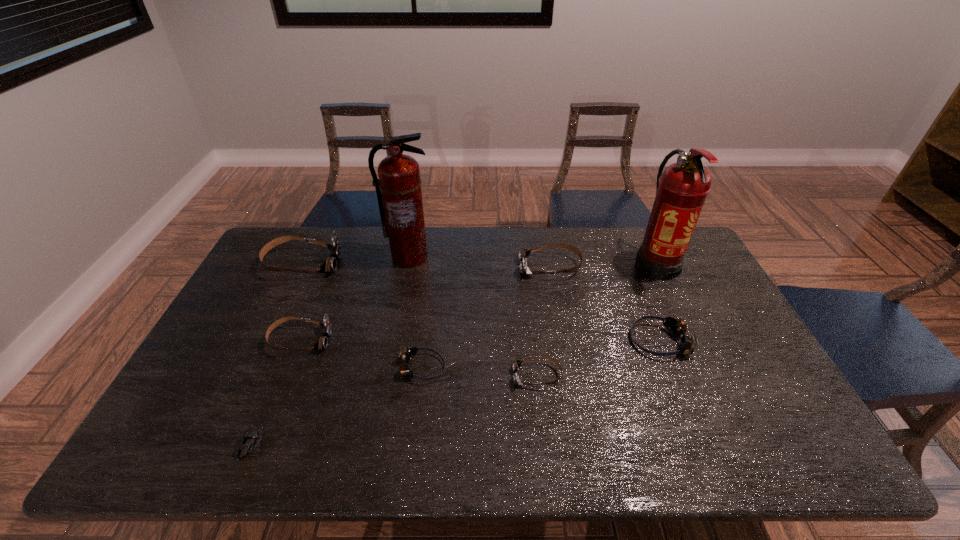
At what (x,y) coordinates should I click in order to perform the action: click on the smallest brown goggles. Please return your answer as a coordinate pair (x, y). The width and height of the screenshot is (960, 540). Looking at the image, I should click on (516, 364).

You are a GUI agent. You are given a task and a screenshot of the screen. Output one action in this format:
    pyautogui.click(x=<x>, y=<y>)
    Task: Click on the nearest object
    The width and height of the screenshot is (960, 540).
    Given the screenshot: What is the action you would take?
    pyautogui.click(x=252, y=437)

Image resolution: width=960 pixels, height=540 pixels. In order to click on computer mouse in this screenshot , I will do `click(252, 437)`.

At what (x,y) coordinates should I click in order to perform the action: click on free space located on the front-facing side of the right red fire extinguisher. Please return your answer as a coordinate pair (x, y). Looking at the image, I should click on (714, 384).

Locate an element on the screen. vacant space located 0.290m on the side of the left red fire extinguisher with the handle and hose is located at coordinates (395, 333).

I want to click on free space located 0.130m on the front-facing side of the tallest goggles, so click(x=376, y=264).

Find the location of `free space located 0.090m on the front-facing side of the third smallest brown goggles`. free space located 0.090m on the front-facing side of the third smallest brown goggles is located at coordinates (492, 267).

I want to click on free space located 0.250m on the front-facing side of the third smallest brown goggles, so click(x=446, y=267).

Locate an element on the screen. This screenshot has width=960, height=540. free space located 0.110m on the front-facing side of the third smallest brown goggles is located at coordinates (487, 267).

Where is `vacant space located 0.230m through the lenses of the bigger bronze goggles`? This screenshot has height=540, width=960. vacant space located 0.230m through the lenses of the bigger bronze goggles is located at coordinates (550, 341).